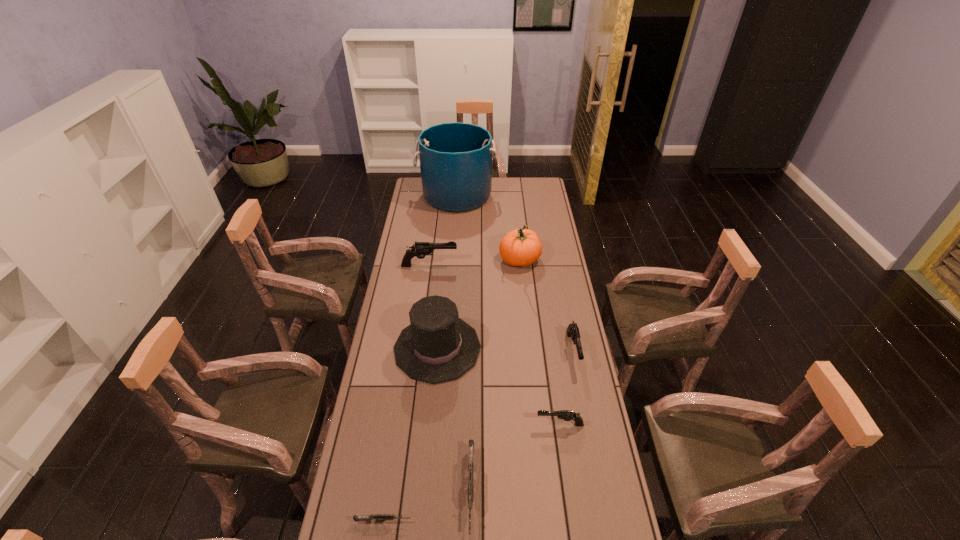
I want to click on vacant space at the far right corner, so click(528, 177).

Identify the location of vacant space that is in between the bucket and the second nearest black gun. Image resolution: width=960 pixels, height=540 pixels. (515, 273).

Where is `free area in between the blue bucket and the second farthest black gun`? This screenshot has width=960, height=540. free area in between the blue bucket and the second farthest black gun is located at coordinates (515, 273).

Find the location of a particular element. This screenshot has width=960, height=540. free space between the farthest gun and the bucket is located at coordinates (443, 231).

This screenshot has width=960, height=540. Identify the location of empty space between the farthest object and the second biggest black gun. (515, 273).

Identify the location of vacant space that is in between the third nearest object and the second biggest black gun. (566, 388).

This screenshot has height=540, width=960. I want to click on unoccupied area between the farthest object and the fourth tallest object, so click(x=443, y=231).

Image resolution: width=960 pixels, height=540 pixels. What are the coordinates of `empty space between the purple dress hat and the pumpkin` in the screenshot? It's located at (479, 305).

Select which object is the second closest to the right grey gun. Please provide its 2D coordinates. Your answer should be formatted as a tuple, i.e. [(x, y)], where the tuple contains the x and y coordinates of a point satisfying the conditions above.

[(567, 415)]

Locate which object ranks sixth in proximity to the third tallest object. Please provide its 2D coordinates. Your answer should be formatted as a tuple, i.e. [(x, y)], where the tuple contains the x and y coordinates of a point satisfying the conditions above.

[(377, 517)]